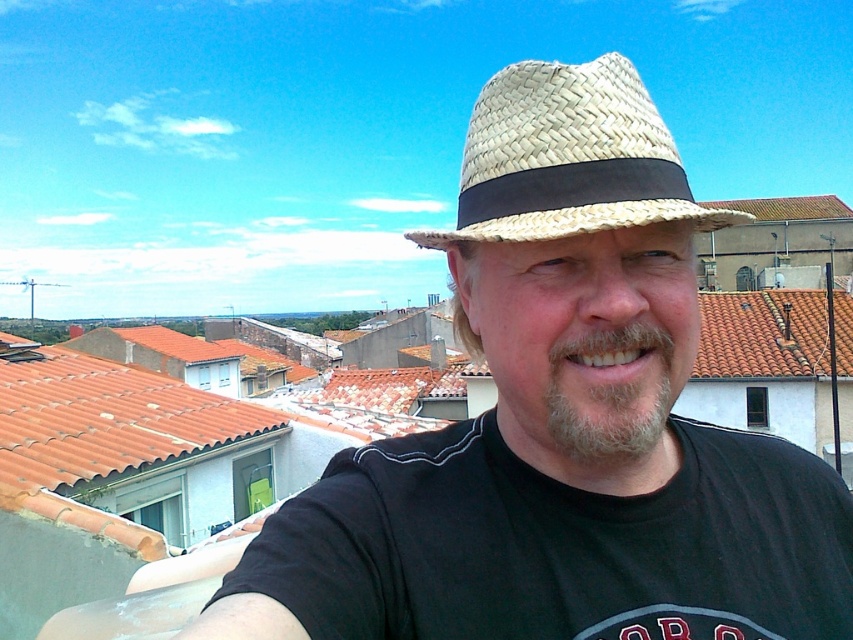
You are a photographer trying to capture the perfect shot of the woven straw hat at center and the woven straw hat at upper center. Given that your camera has a maximum focus range of 1 meter, will you be able to focus on both hats simultaneously?

The woven straw hat at center is 1.13 meters from the woven straw hat at upper center. Since the distance between them exceeds the camera maximum focus range of 1 meter, you cannot focus on both simultaneously.

From the picture: You are standing on a rooftop and see the woven straw hat at center and the woven straw hat at upper center. Which one is closer to you?

The woven straw hat at center is closer to you because the woven straw hat at upper center is behind it.

Consider the image. You are a photographer trying to capture the perfect shot of the woven straw hat at center and the woven straw hat at upper center. Which hat should you focus on to ensure it fits entirely within the frame without cropping?

The woven straw hat at center is wider than the woven straw hat at upper center, so focusing on the woven straw hat at upper center will ensure it fits entirely within the frame without cropping.